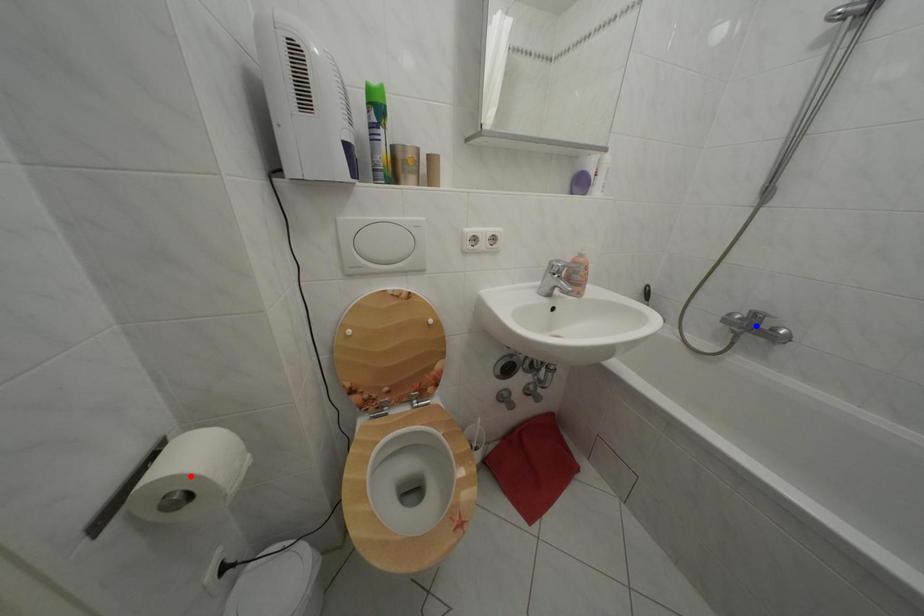
Question: Which of the two points in the image is closer to the camera?

Choices:
 (A) Blue point is closer.
 (B) Red point is closer.

Answer: (B)